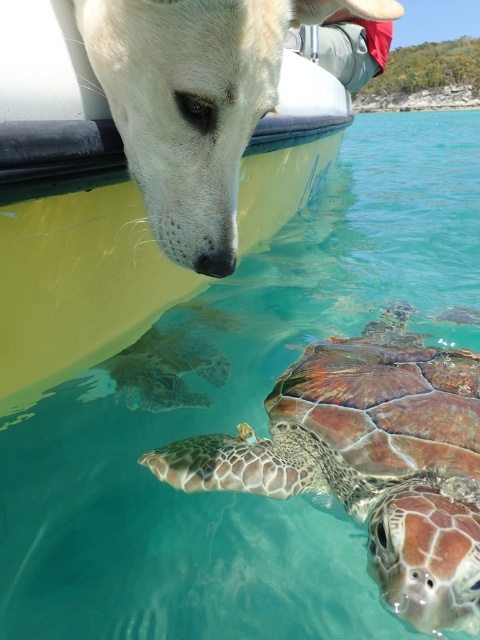
Question: Which point is farther to the camera?

Choices:
 (A) (278, 13)
 (B) (312, 424)

Answer: (B)

Question: Which of the following is the farthest from the observer?

Choices:
 (A) white matte dog at upper left
 (B) brown textured shell at lower center

Answer: (A)

Question: Is brown textured shell at lower center to the left of white matte dog at upper left from the viewer's perspective?

Choices:
 (A) yes
 (B) no

Answer: (B)

Question: Among these points, which one is farthest from the camera?

Choices:
 (A) (178, 17)
 (B) (418, 403)

Answer: (B)

Question: Is brown textured shell at lower center thinner than white matte dog at upper left?

Choices:
 (A) no
 (B) yes

Answer: (A)

Question: Does brown textured shell at lower center appear on the right side of white matte dog at upper left?

Choices:
 (A) yes
 (B) no

Answer: (A)